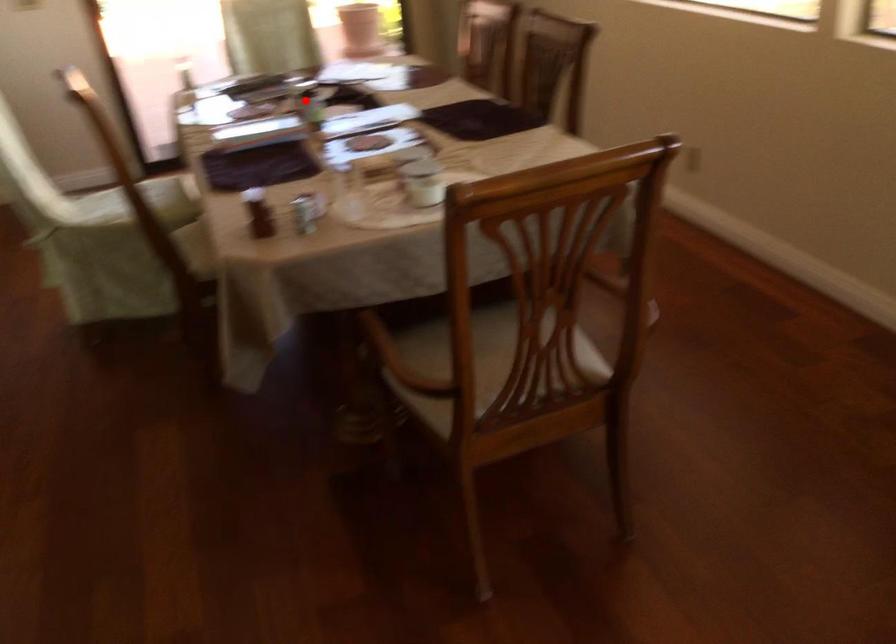
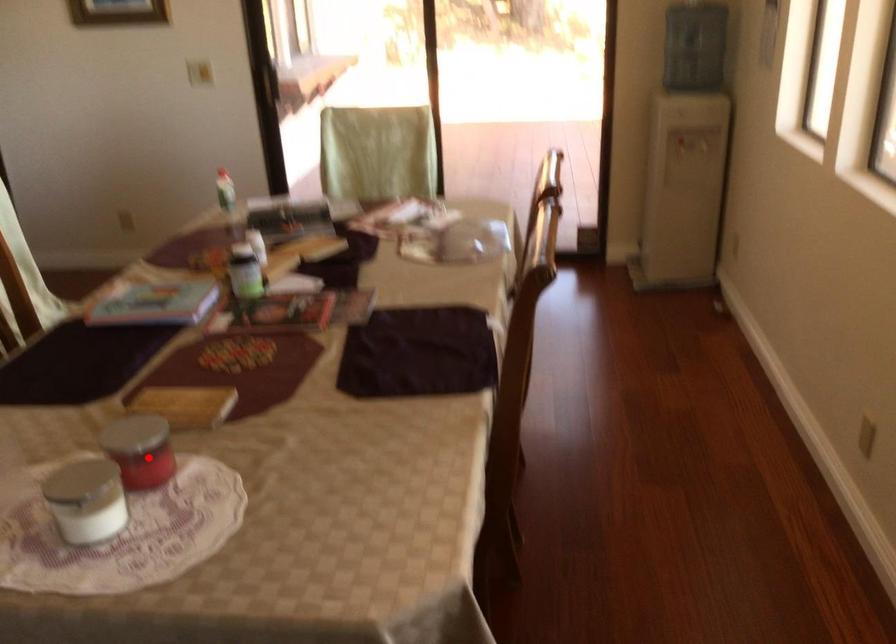
I am providing you with two images of the same scene from different viewpoints. A red point is marked on the first image and another point is marked on the second image. Is the marked point in image1 the same physical position as the marked point in image2?

No